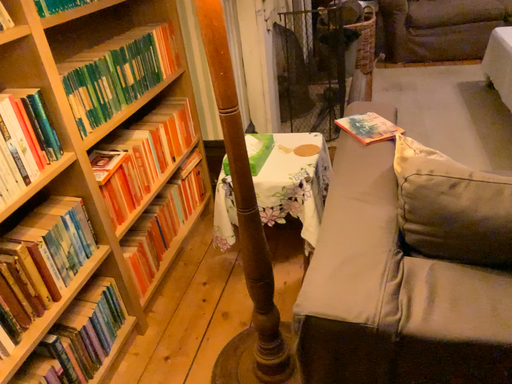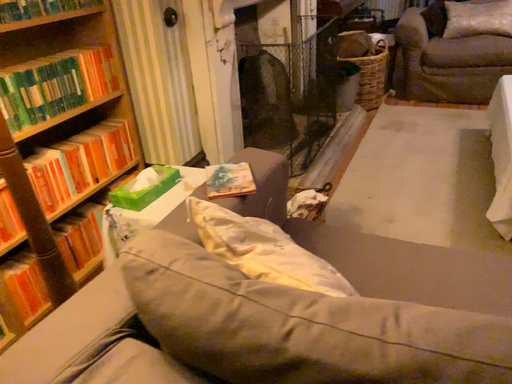
Question: Which way did the camera rotate in the video?

Choices:
 (A) rotated right
 (B) rotated left

Answer: (B)